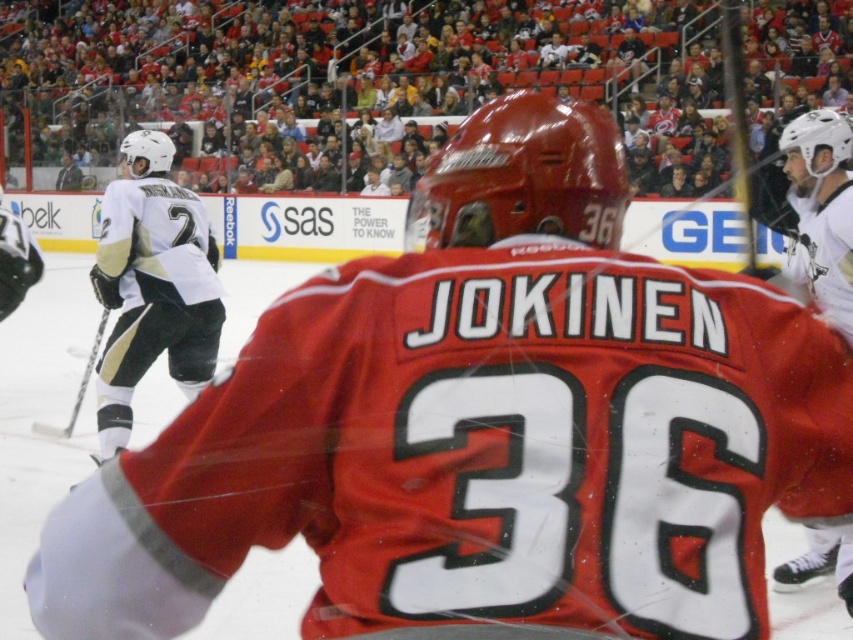
Is white reebok jersey at left to the right of matte white helmet at upper right from the viewer's perspective?

No, white reebok jersey at left is not to the right of matte white helmet at upper right.

Can you confirm if white reebok jersey at left is positioned above matte white helmet at upper right?

Actually, white reebok jersey at left is below matte white helmet at upper right.

Who is more distant from viewer, (142, 173) or (840, 170)?

The point (142, 173) is more distant.

Where is `white reebok jersey at left`? The height and width of the screenshot is (640, 853). white reebok jersey at left is located at coordinates (152, 284).

Does matte white helmet at upper right appear on the left side of black metallic hockey stick at left?

Incorrect, matte white helmet at upper right is not on the left side of black metallic hockey stick at left.

Which is more to the left, matte white helmet at upper right or black metallic hockey stick at left?

Positioned to the left is black metallic hockey stick at left.

Locate an element on the screen. Image resolution: width=853 pixels, height=640 pixels. matte white helmet at upper right is located at coordinates (820, 209).

Find the location of a particular element. The image size is (853, 640). matte white helmet at upper right is located at coordinates (820, 209).

Between white reebok jersey at left and black metallic hockey stick at left, which one has more height?

Standing taller between the two is white reebok jersey at left.

Does white reebok jersey at left have a lesser width compared to black metallic hockey stick at left?

Correct, white reebok jersey at left's width is less than black metallic hockey stick at left's.

Which is behind, point (122, 268) or point (77, 404)?

Point (77, 404)

Where is `white reebok jersey at left`? The height and width of the screenshot is (640, 853). white reebok jersey at left is located at coordinates (152, 284).